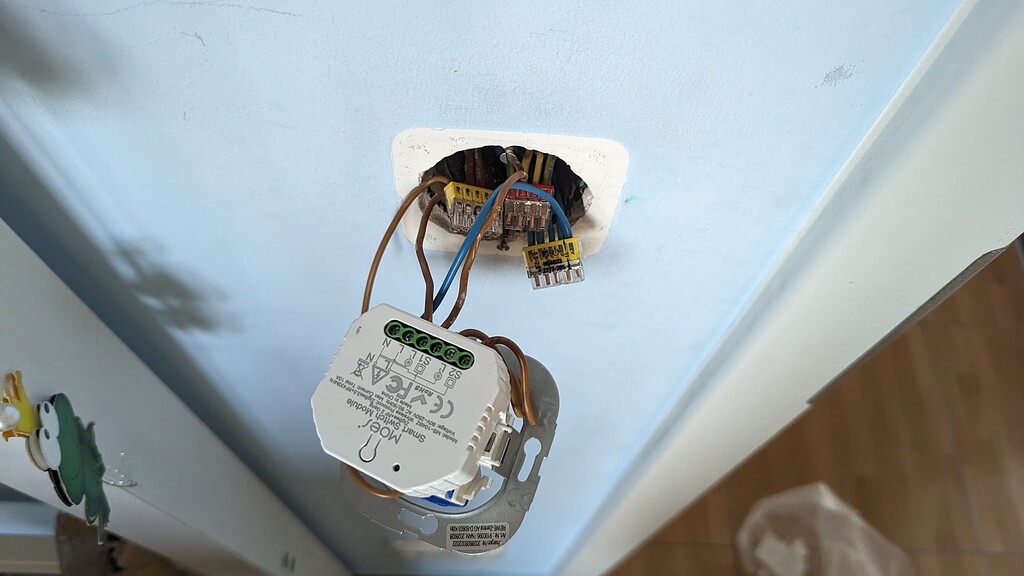
What are the coordinates of `wall` in the screenshot? It's located at (357, 251).